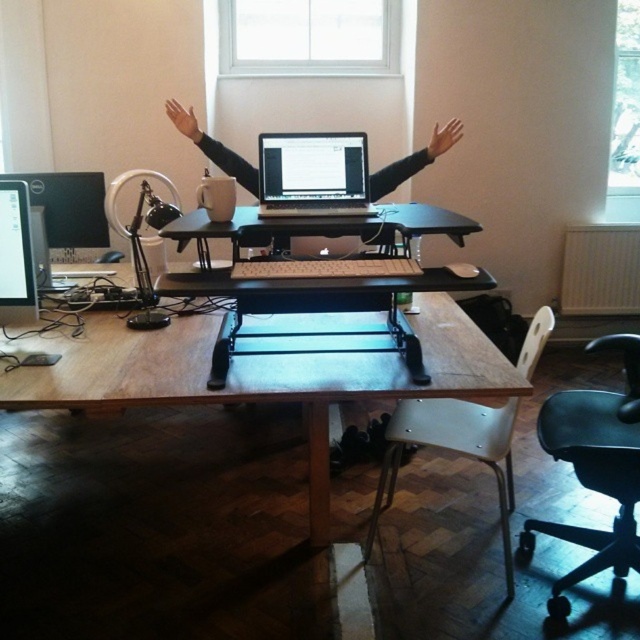
Does black leather swivel chair at lower right have a lesser height compared to satin black laptop at center?

Incorrect, black leather swivel chair at lower right's height does not fall short of satin black laptop at center's.

Who is lower down, black leather swivel chair at lower right or satin black laptop at center?

black leather swivel chair at lower right

Which is behind, point (608, 458) or point (316, 202)?

The point (316, 202) is behind.

Image resolution: width=640 pixels, height=640 pixels. Identify the location of black leather swivel chair at lower right. (595, 468).

Who is higher up, wooden table at center or matte black laptop at center?

matte black laptop at center

Who is more distant from viewer, (x=148, y=336) or (x=250, y=186)?

The point (x=250, y=186) is more distant.

Locate an element on the screen. The width and height of the screenshot is (640, 640). wooden table at center is located at coordinates (259, 376).

Is black leather swivel chair at lower right behind white plastic swivel chair at lower right?

No, black leather swivel chair at lower right is in front of white plastic swivel chair at lower right.

Is black leather swivel chair at lower right bigger than white plastic swivel chair at lower right?

No.

Which is behind, point (621, 394) or point (440, 444)?

The point (621, 394) is more distant.

At what (x,y) coordinates should I click in order to perform the action: click on black leather swivel chair at lower right. Please return your answer as a coordinate pair (x, y). Image resolution: width=640 pixels, height=640 pixels. Looking at the image, I should click on (595, 468).